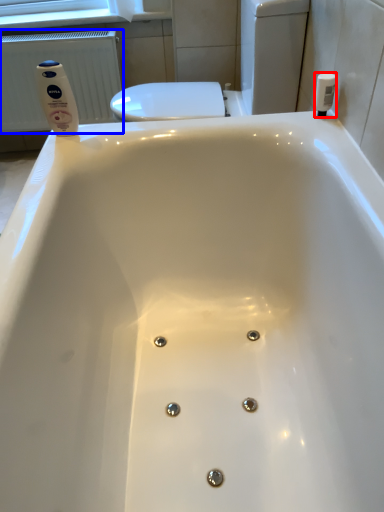
Question: Which point is closer to the camera, toiletry (highlighted by a red box) or radiator (highlighted by a blue box)?

Choices:
 (A) toiletry
 (B) radiator

Answer: (A)